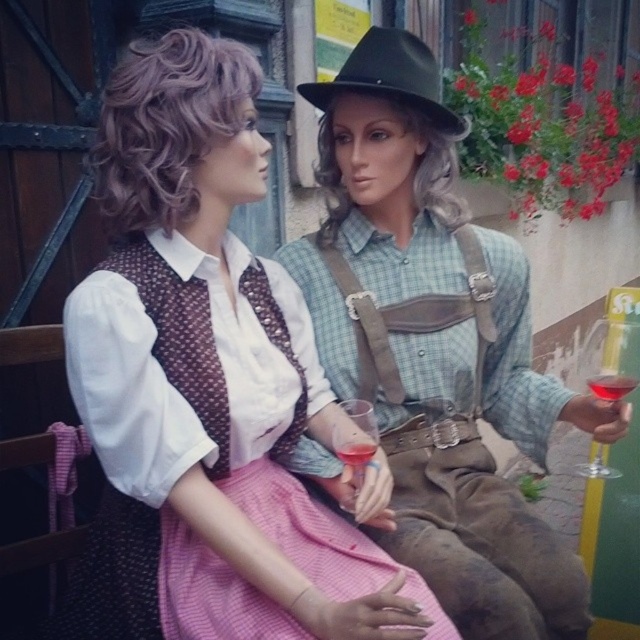
You are a costume designer preparing for a play and need to ensure that the matte white blouse at center and the gray synthetic wig at center fit together. Based on their sizes, which one should you adjust first to ensure proper proportions?

The matte white blouse at center has a larger size compared to the gray synthetic wig at center. Therefore, you should adjust the gray synthetic wig at center first to match the scale of the blouse.

You are a photographer setting up a shoot. You need to place a 12cm wide decorative plate between the gray synthetic wig at center and the translucent glass wine glass at right. Can the plate fit between them without overlapping either object?

The gray synthetic wig at center is smaller than the translucent glass wine glass at right. Since the plate is 12cm wide, we need to know the distance between them to determine if it fits. However, the provided information does not specify the distance between the two objects. Without this measurement, it is impossible to confirm if the plate will fit without overlapping.

You are a photographer setting up a shot of the matte white blouse at center. You need to ensure the blouse is in focus while the background remains slightly blurred. Based on the given information, what is the minimum distance you should set your camera focus to achieve this effect?

The minimum distance to set the camera focus should be 33.69 inches to ensure the matte white blouse at center is in focus while keeping the background blurred.